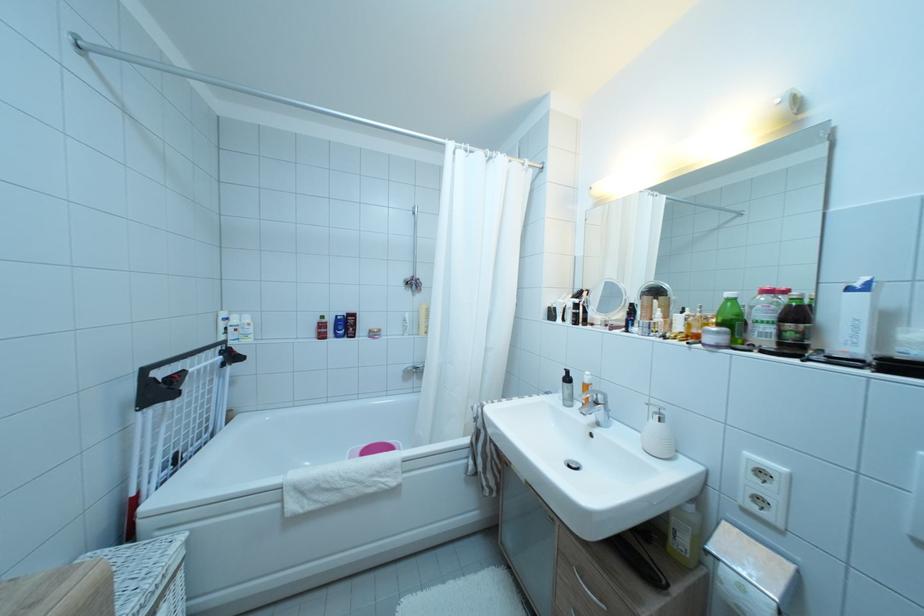
The location [470,288] corresponds to which object?

It refers to a white shower curtain.